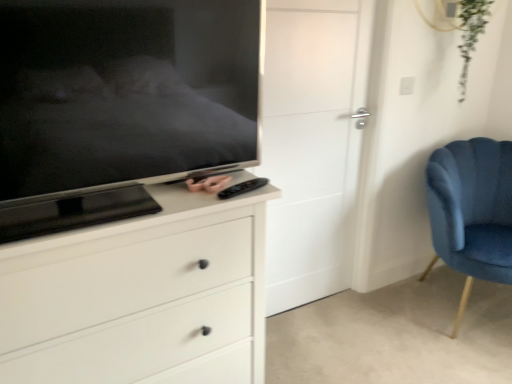
Question: From a real-world perspective, is white matte chest of drawers at center above or below velvet blue chair at right?

Choices:
 (A) below
 (B) above

Answer: (B)

Question: Is white matte chest of drawers at center inside the boundaries of velvet blue chair at right, or outside?

Choices:
 (A) inside
 (B) outside

Answer: (B)

Question: Which object is positioned farthest from the white matte door at center?

Choices:
 (A) matte black tv at left
 (B) white matte chest of drawers at center
 (C) pink matte remote control at center
 (D) velvet blue chair at right
 (E) black plastic remote at center

Answer: (C)

Question: Based on their relative distances, which object is farther from the matte black tv at left?

Choices:
 (A) velvet blue chair at right
 (B) black plastic remote at center
 (C) white matte door at center
 (D) pink matte remote control at center
 (E) white matte chest of drawers at center

Answer: (A)